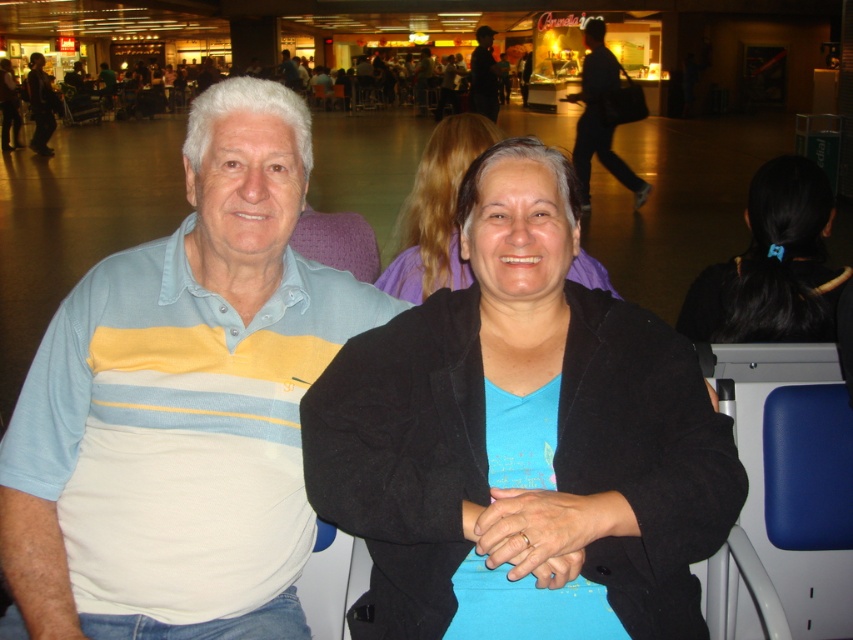
Between light blue and yellow striped polo shirt at center and matte black jacket at upper center, which one has more height?

With more height is matte black jacket at upper center.

Can you confirm if light blue and yellow striped polo shirt at center is thinner than matte black jacket at upper center?

Yes, light blue and yellow striped polo shirt at center is thinner than matte black jacket at upper center.

Who is more distant from viewer, [160,284] or [479,112]?

Point [479,112]

The height and width of the screenshot is (640, 853). In order to click on light blue and yellow striped polo shirt at center in this screenshot , I will do `click(183, 403)`.

Does point (445, 451) come behind point (482, 64)?

No, (445, 451) is in front of (482, 64).

Which of these two, black soft jacket at center or matte black jacket at upper center, stands shorter?

Standing shorter between the two is black soft jacket at center.

Between point (467, 342) and point (483, 52), which one is positioned in front?

Point (467, 342) is more forward.

Image resolution: width=853 pixels, height=640 pixels. In order to click on black soft jacket at center in this screenshot , I will do `click(520, 397)`.

Is point (408, 300) positioned behind point (637, 180)?

No, it is not.

This screenshot has width=853, height=640. Find the location of `blue matte jacket at center`. blue matte jacket at center is located at coordinates (436, 211).

Is point (415, 221) closer to viewer compared to point (596, 131)?

That is True.

I want to click on blue matte jacket at center, so click(x=436, y=211).